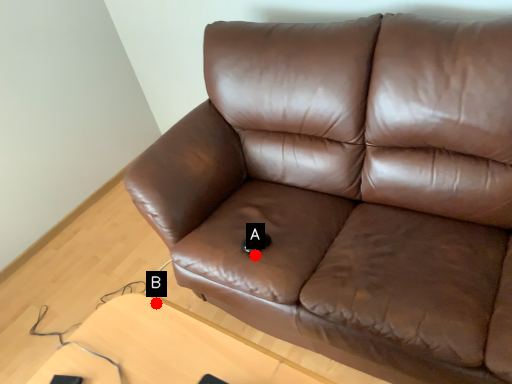
Question: Two points are circled on the image, labeled by A and B beside each circle. Which point appears farthest from the camera in this image?

Choices:
 (A) A is further
 (B) B is further

Answer: (A)